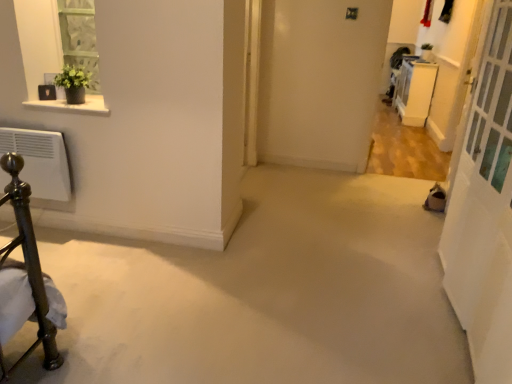
Question: Relative to white glossy cabinet at upper right, is white glass screen door at right in front or behind?

Choices:
 (A) front
 (B) behind

Answer: (A)

Question: From the image's perspective, is white glass screen door at right located above or below white glossy cabinet at upper right?

Choices:
 (A) below
 (B) above

Answer: (A)

Question: Which object is the closest to the white glossy cabinet at upper right?

Choices:
 (A) white glass screen door at right
 (B) white marble shelf at upper left

Answer: (A)

Question: Estimate the real-world distances between objects in this image. Which object is closer to the white marble shelf at upper left?

Choices:
 (A) white glass screen door at right
 (B) white glossy cabinet at upper right

Answer: (A)